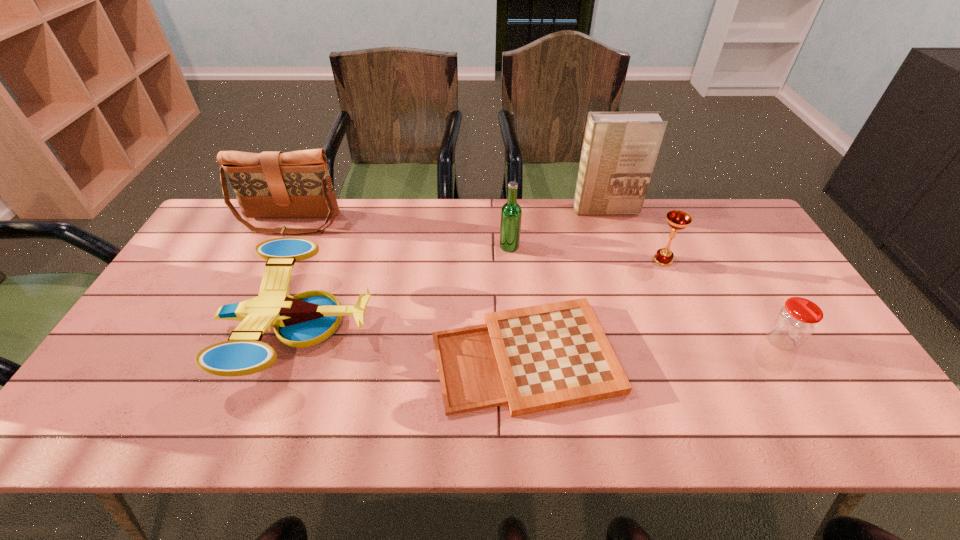
Identify the location of the tallest object. (619, 151).

Locate an element on the screen. shoulder bag is located at coordinates (272, 184).

Where is `beer bottle`? This screenshot has width=960, height=540. beer bottle is located at coordinates (511, 213).

Locate an element on the screen. This screenshot has height=540, width=960. the fourth tallest object is located at coordinates coord(677,220).

In order to click on drone in this screenshot , I will do `click(309, 318)`.

Find the location of a particular element. This screenshot has width=960, height=540. the rightmost object is located at coordinates (795, 321).

Find the location of a particular element. the shortest object is located at coordinates (543, 357).

I want to click on vacant space situated 0.140m on the cover of the phonebook, so click(x=615, y=242).

Where is `free space located 0.050m on the front-facing side of the shoulder bag`? The height and width of the screenshot is (540, 960). free space located 0.050m on the front-facing side of the shoulder bag is located at coordinates (279, 247).

Locate an element on the screen. The image size is (960, 540). vacant space located on the back of the beer bottle is located at coordinates (506, 200).